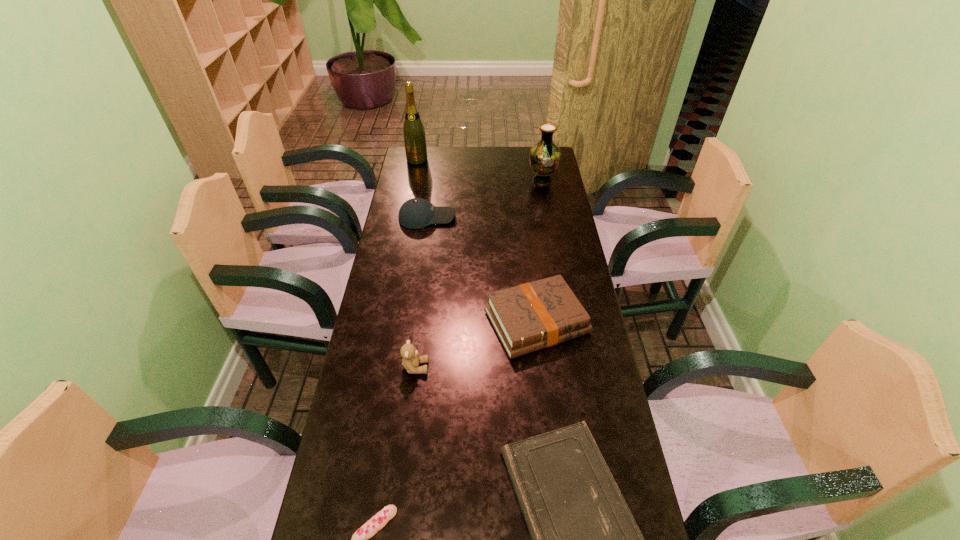
Identify the location of the farthest object. The image size is (960, 540). (413, 131).

I want to click on the tallest object, so click(x=413, y=131).

The width and height of the screenshot is (960, 540). Identify the location of vase. (544, 156).

The image size is (960, 540). Find the location of `the sixth nearest object`. the sixth nearest object is located at coordinates (544, 156).

You are a GUI agent. You are given a task and a screenshot of the screen. Output one action in this format:
    pyautogui.click(x=<x>, y=<y>)
    Task: Click on the fifth shortest object
    The width and height of the screenshot is (960, 540).
    Given the screenshot: What is the action you would take?
    pyautogui.click(x=411, y=359)

Where is `the third farthest object`? The height and width of the screenshot is (540, 960). the third farthest object is located at coordinates (416, 213).

Find the location of a particular element. The width and height of the screenshot is (960, 540). hardback book is located at coordinates (x=532, y=316).

Identify the location of free location located on the front-facing side of the wine bottle. The image size is (960, 540). [x=415, y=174].

This screenshot has width=960, height=540. Find the location of `vacant space located 0.290m on the left of the vase`. vacant space located 0.290m on the left of the vase is located at coordinates (463, 180).

Image resolution: width=960 pixels, height=540 pixels. I want to click on vacant space located 0.310m on the face of the teddy bear, so click(x=535, y=367).